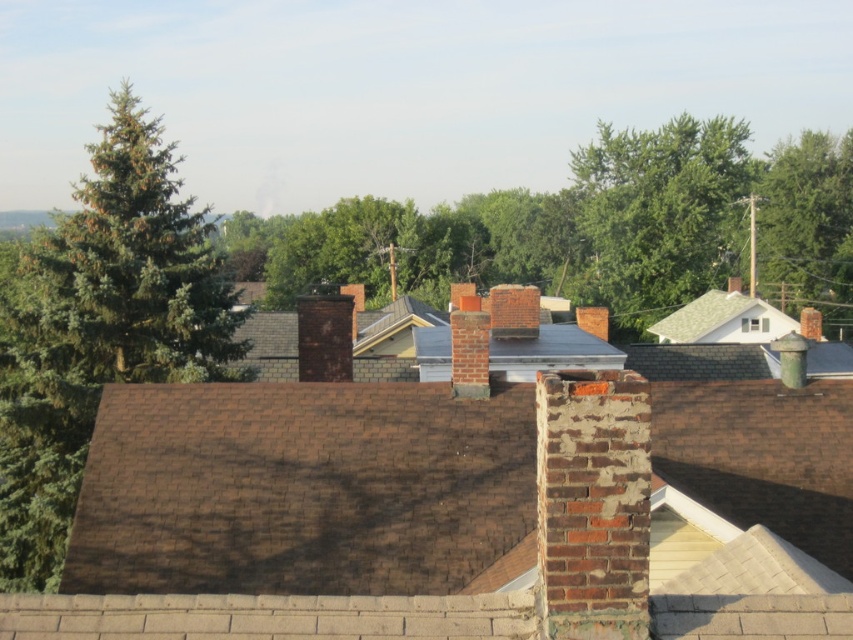
Question: Is green leafy tree at center further to the viewer compared to green shingles at upper right?

Choices:
 (A) no
 (B) yes

Answer: (A)

Question: Is green needle-like tree at left to the left of green shingles at upper right from the viewer's perspective?

Choices:
 (A) no
 (B) yes

Answer: (B)

Question: Which point is farther to the camera?

Choices:
 (A) (178, 371)
 (B) (587, 180)
 (C) (669, 317)

Answer: (B)

Question: Which is nearer to the green leafy tree at center?

Choices:
 (A) green needle-like tree at left
 (B) gray shingles at center

Answer: (B)

Question: Estimate the real-world distances between objects in this image. Which object is closer to the green needle-like tree at left?

Choices:
 (A) gray shingles at center
 (B) green leafy tree at center
 (C) green shingles at upper right

Answer: (A)

Question: Can you confirm if green leafy tree at center is positioned to the left of green shingles at upper right?

Choices:
 (A) yes
 (B) no

Answer: (A)